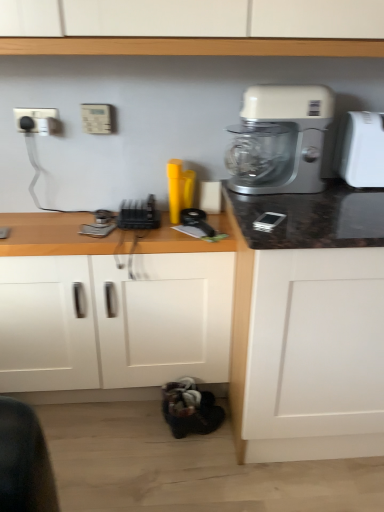
Where is `free point above wooden at lower left (from a real-world perspective)`? free point above wooden at lower left (from a real-world perspective) is located at coordinates (87, 220).